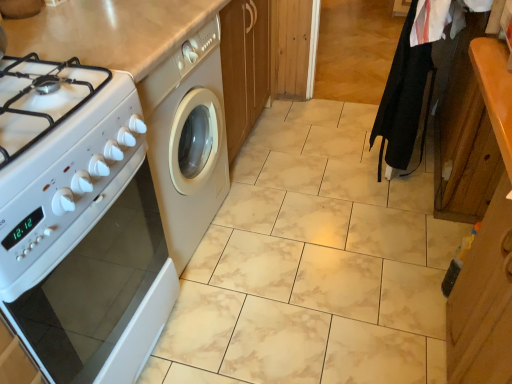
Question: Does white glossy oven at left have a greater width compared to wooden cabinet at right?

Choices:
 (A) yes
 (B) no

Answer: (A)

Question: Can you confirm if white glossy oven at left is bigger than wooden cabinet at right?

Choices:
 (A) yes
 (B) no

Answer: (B)

Question: Is white glossy oven at left shorter than wooden cabinet at right?

Choices:
 (A) no
 (B) yes

Answer: (B)

Question: Are white glossy oven at left and wooden cabinet at right making contact?

Choices:
 (A) yes
 (B) no

Answer: (B)

Question: Is white glossy oven at left positioned behind wooden cabinet at right?

Choices:
 (A) no
 (B) yes

Answer: (B)

Question: Do you think wooden cabinet at right is within white glossy oven at left, or outside of it?

Choices:
 (A) inside
 (B) outside

Answer: (B)

Question: From a real-world perspective, relative to white glossy oven at left, is wooden cabinet at right vertically above or below?

Choices:
 (A) above
 (B) below

Answer: (A)

Question: Is wooden cabinet at right taller or shorter than white glossy oven at left?

Choices:
 (A) short
 (B) tall

Answer: (B)

Question: Looking at the image, does wooden cabinet at right seem bigger or smaller compared to white glossy oven at left?

Choices:
 (A) big
 (B) small

Answer: (A)

Question: In terms of height, does white glossy oven at left look taller or shorter compared to black fabric robe at right?

Choices:
 (A) short
 (B) tall

Answer: (A)

Question: Looking at their shapes, would you say white glossy oven at left is wider or thinner than black fabric robe at right?

Choices:
 (A) thin
 (B) wide

Answer: (B)

Question: Is white glossy oven at left inside the boundaries of black fabric robe at right, or outside?

Choices:
 (A) outside
 (B) inside

Answer: (A)

Question: Is white glossy oven at left bigger or smaller than black fabric robe at right?

Choices:
 (A) small
 (B) big

Answer: (B)

Question: Looking at their shapes, would you say wooden cabinet at right is wider or thinner than black fabric robe at right?

Choices:
 (A) thin
 (B) wide

Answer: (B)

Question: In the image, is wooden cabinet at right positioned in front of or behind black fabric robe at right?

Choices:
 (A) front
 (B) behind

Answer: (A)